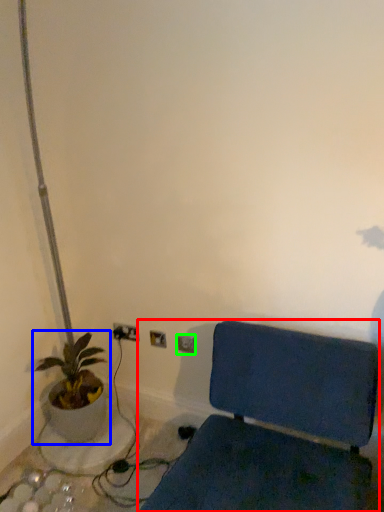
Question: Which object is positioned closest to furniture (highlighted by a red box)? Select from houseplant (highlighted by a blue box) and electric outlet (highlighted by a green box).

Choices:
 (A) houseplant
 (B) electric outlet

Answer: (B)